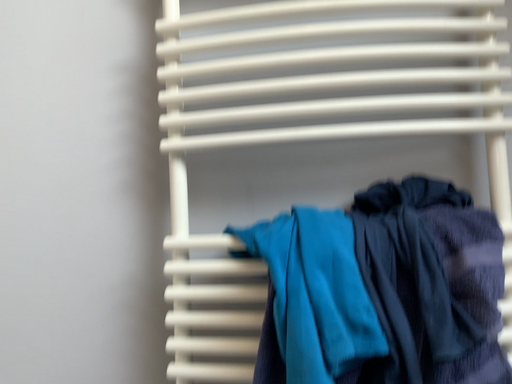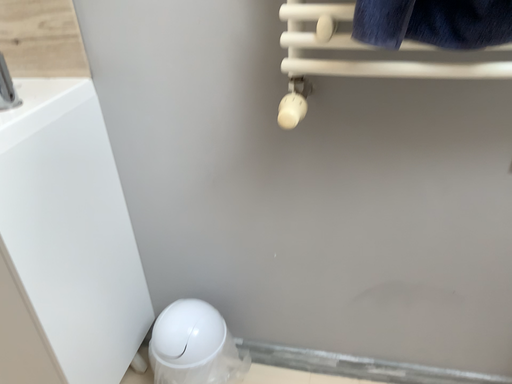
Question: Which way did the camera rotate in the video?

Choices:
 (A) rotated upward
 (B) rotated downward

Answer: (B)